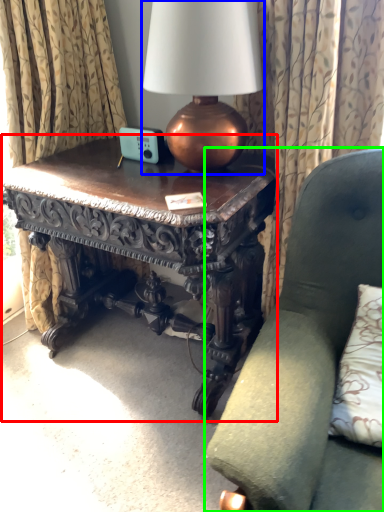
Question: Which object is the farthest from table (highlighted by a red box)? Choose among these: lamp (highlighted by a blue box) or chair (highlighted by a green box).

Choices:
 (A) lamp
 (B) chair

Answer: (B)